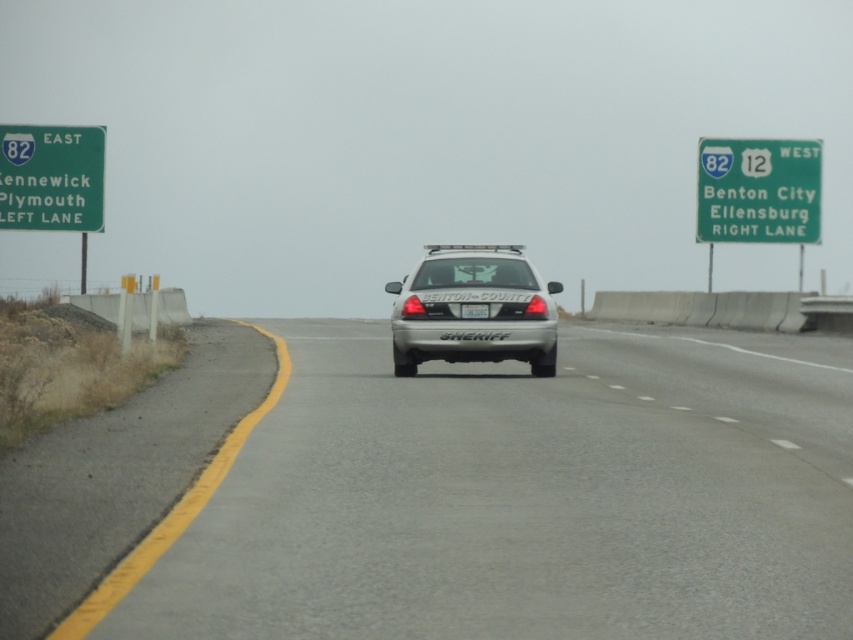
Question: Which of the following is the farthest from the observer?

Choices:
 (A) (473, 310)
 (B) (74, 186)
 (C) (798, 240)
 (D) (659, 499)

Answer: (C)

Question: Which is farther from the green sign at right?

Choices:
 (A) gray asphalt road at center
 (B) green plastic sign at left

Answer: (A)

Question: Does green plastic sign at left appear on the left side of white plastic license plate at center?

Choices:
 (A) yes
 (B) no

Answer: (A)

Question: Can you confirm if green plastic sign at left is positioned below white plastic license plate at center?

Choices:
 (A) yes
 (B) no

Answer: (B)

Question: Among these objects, which one is nearest to the camera?

Choices:
 (A) silver metallic sheriff car at center
 (B) green plastic sign at left
 (C) white plastic license plate at center
 (D) green sign at right

Answer: (A)

Question: Can you confirm if gray asphalt road at center is positioned to the right of green plastic sign at left?

Choices:
 (A) yes
 (B) no

Answer: (A)